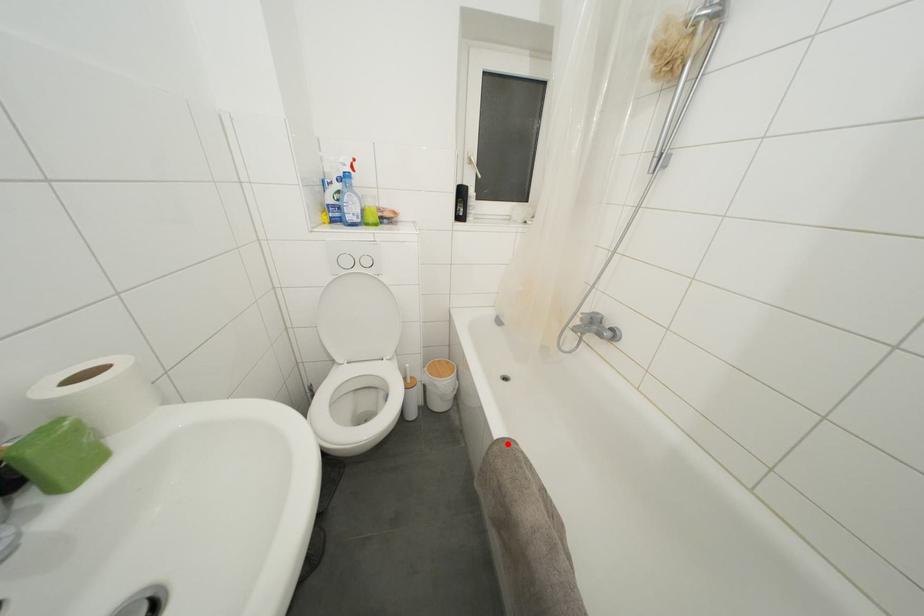
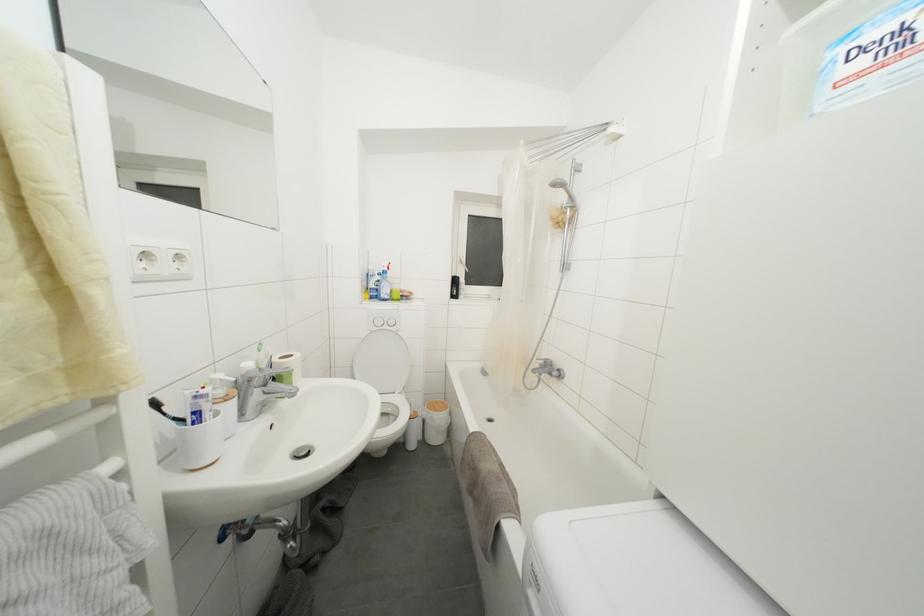
Find the pixel in the second image that matches the highlighted location in the first image.

(480, 438)